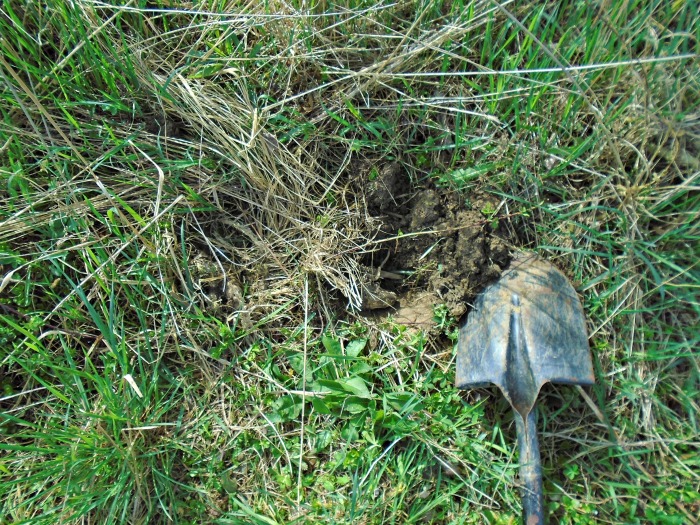
Find the location of `wooden handle`. wooden handle is located at coordinates (535, 520).